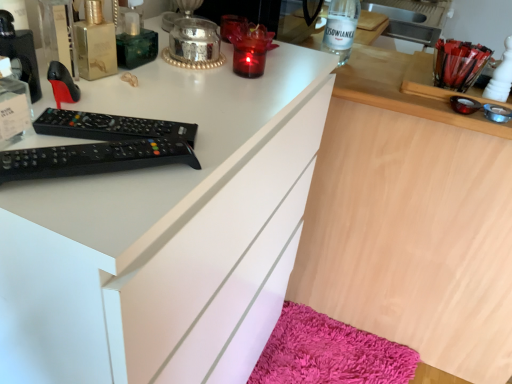
The width and height of the screenshot is (512, 384). In order to click on shaggy pink bath mat at lower right in this screenshot , I will do `click(329, 353)`.

The width and height of the screenshot is (512, 384). What do you see at coordinates (164, 279) in the screenshot?
I see `white matte cabinet at center` at bounding box center [164, 279].

Where is `white matte cabinet at center`? This screenshot has height=384, width=512. white matte cabinet at center is located at coordinates (164, 279).

What is the approximate height of wooden desk at center?

The height of wooden desk at center is 92.17 centimeters.

Where is `clear glass bottle at upper center`? Image resolution: width=512 pixels, height=384 pixels. clear glass bottle at upper center is located at coordinates pyautogui.click(x=341, y=28).

Is white matte cabinet at center looking in the opposite direction of shaggy pink bath mat at lower right?

No, white matte cabinet at center is not facing the opposite direction of shaggy pink bath mat at lower right.

In terms of height, does white matte cabinet at center look taller or shorter compared to shaggy pink bath mat at lower right?

In the image, white matte cabinet at center appears to be taller than shaggy pink bath mat at lower right.

Considering the points (217, 354) and (392, 347), which point is behind, point (217, 354) or point (392, 347)?

Positioned behind is point (392, 347).

From a real-world perspective, which is physically below, white matte cabinet at center or shaggy pink bath mat at lower right?

From a 3D spatial view, shaggy pink bath mat at lower right is below.

Based on the photo, measure the distance from white matte cabinet at center to clear glass bottle at upper center.

white matte cabinet at center and clear glass bottle at upper center are 67.25 centimeters apart.

Is white matte cabinet at center facing towards clear glass bottle at upper center?

No, white matte cabinet at center is not oriented towards clear glass bottle at upper center.

What are the coordinates of `cabinetry in front of the clear glass bottle at upper center` in the screenshot? It's located at (164, 279).

Which is closer to the camera, (104, 168) or (292, 307)?

Point (104, 168) appears to be closer to the viewer than point (292, 307).

Are black plastic remote control at upper left and shaggy pink bath mat at lower right far apart?

Absolutely, black plastic remote control at upper left is distant from shaggy pink bath mat at lower right.

From the image's perspective, is black plastic remote control at upper left under shaggy pink bath mat at lower right?

No.

Would you say black plastic remote control at upper left is inside or outside shaggy pink bath mat at lower right?

black plastic remote control at upper left is located beyond the bounds of shaggy pink bath mat at lower right.

Is point (338, 46) closer or farther from the camera than point (151, 287)?

Point (338, 46).

From a real-world perspective, is clear glass bottle at upper center located beneath white matte cabinet at center?

No.

From the image's perspective, is clear glass bottle at upper center above white matte cabinet at center?

Indeed, from the image's perspective, clear glass bottle at upper center is shown above white matte cabinet at center.

Considering the sizes of objects clear glass bottle at upper center and white matte cabinet at center in the image provided, who is bigger, clear glass bottle at upper center or white matte cabinet at center?

Bigger between the two is white matte cabinet at center.

From the image's perspective, is wooden desk at center above clear glass bottle at upper center?

No, from the image's perspective, wooden desk at center is not over clear glass bottle at upper center.

Considering the positions of objects wooden desk at center and clear glass bottle at upper center in the image provided, who is behind, wooden desk at center or clear glass bottle at upper center?

clear glass bottle at upper center is further away from the camera.

Which is farther, (414,283) or (323,47)?

The point (414,283) is more distant.

Choose the correct answer: Is wooden desk at center inside clear glass bottle at upper center or outside it?

wooden desk at center is outside clear glass bottle at upper center.

Is shaggy pink bath mat at lower right completely or partially outside of white matte cabinet at center?

shaggy pink bath mat at lower right lies outside white matte cabinet at center's area.

Which of these two, shaggy pink bath mat at lower right or white matte cabinet at center, stands taller?

white matte cabinet at center is taller.

Is shaggy pink bath mat at lower right far away from white matte cabinet at center?

No, shaggy pink bath mat at lower right is not far from white matte cabinet at center.

Where is `cabinetry above the shaggy pink bath mat at lower right (from the image's perspective)`? cabinetry above the shaggy pink bath mat at lower right (from the image's perspective) is located at coordinates (164, 279).

From the image's perspective, which object appears higher, wooden desk at center or shaggy pink bath mat at lower right?

wooden desk at center.

How many degrees apart are the facing directions of wooden desk at center and shaggy pink bath mat at lower right?

The angular difference between wooden desk at center and shaggy pink bath mat at lower right is 3.14 degrees.

The height and width of the screenshot is (384, 512). What are the coordinates of `computer in front of the shaggy pink bath mat at lower right` in the screenshot? It's located at (411, 222).

Is wooden desk at center wider than shaggy pink bath mat at lower right?

Yes, wooden desk at center is wider than shaggy pink bath mat at lower right.

You are a GUI agent. You are given a task and a screenshot of the screen. Output one action in this format:
    pyautogui.click(x=<x>, y=<y>)
    Task: Click on the bath mat below the white matte cabinet at center (from a real-world perspective)
    
    Given the screenshot: What is the action you would take?
    pyautogui.click(x=329, y=353)

Find the location of a particular element. cabinetry that is on the left side of clear glass bottle at upper center is located at coordinates (164, 279).

Looking at the image, which one is located further to wooden desk at center, black plastic remote control at upper left or shaggy pink bath mat at lower right?

The object further to wooden desk at center is black plastic remote control at upper left.

Based on their spatial positions, is wooden desk at center or white matte cabinet at center further from shaggy pink bath mat at lower right?

white matte cabinet at center.

Considering their positions, is wooden desk at center positioned closer to shaggy pink bath mat at lower right than clear glass bottle at upper center?

The object closer to shaggy pink bath mat at lower right is wooden desk at center.

In the scene shown: Based on their spatial positions, is white matte cabinet at center or shaggy pink bath mat at lower right closer to wooden desk at center?

The object closer to wooden desk at center is shaggy pink bath mat at lower right.

From the picture: When comparing their distances from black plastic remote control at upper left, does shaggy pink bath mat at lower right or white matte cabinet at center seem further?

Based on the image, shaggy pink bath mat at lower right appears to be further to black plastic remote control at upper left.

Looking at the image, which one is located further to wooden desk at center, shaggy pink bath mat at lower right or black plastic remote control at upper left?

black plastic remote control at upper left is further to wooden desk at center.

Which object lies nearer to the anchor point white matte cabinet at center, black plastic remote control at upper left or clear glass bottle at upper center?

Based on the image, black plastic remote control at upper left appears to be nearer to white matte cabinet at center.

When comparing their distances from white matte cabinet at center, does wooden desk at center or black plastic remote control at upper left seem further?

wooden desk at center lies further to white matte cabinet at center than the other object.

Locate an element on the screen. remote control between clear glass bottle at upper center and shaggy pink bath mat at lower right vertically is located at coordinates (93, 158).

Identify the location of bottle situated between white matte cabinet at center and wooden desk at center from left to right. The height and width of the screenshot is (384, 512). (341, 28).

Find the location of a particular element. This screenshot has height=384, width=512. remote control positioned between white matte cabinet at center and shaggy pink bath mat at lower right from near to far is located at coordinates (93, 158).

You are a GUI agent. You are given a task and a screenshot of the screen. Output one action in this format:
    pyautogui.click(x=<x>, y=<y>)
    Task: Click on the remote control between white matte cabinet at center and wooden desk at center in the horizontal direction
    
    Given the screenshot: What is the action you would take?
    pyautogui.click(x=93, y=158)